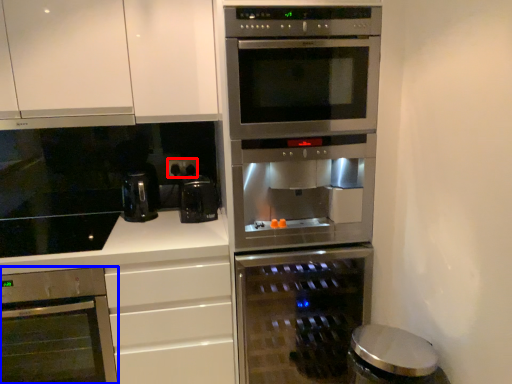
Question: Which point is further to the camera, electric outlet (highlighted by a red box) or oven (highlighted by a blue box)?

Choices:
 (A) electric outlet
 (B) oven

Answer: (A)